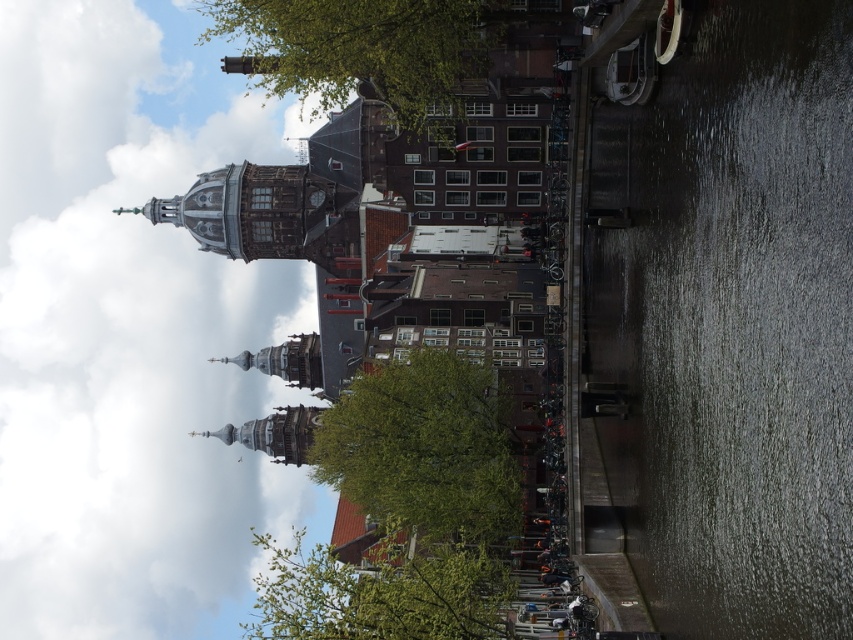
You are a tourist standing at the canal side and want to take a photo of the grand building with the dome. There are two green leafy trees in your viewfinder. Which tree, the green leafy tree at upper center or the green leafy tree at lower center, is closer to the building?

The green leafy tree at lower center is closer to the grand building with the dome because the green leafy tree at upper center is positioned over it, meaning it is farther away from the building.

In the scene shown: You are a tourist standing on the canal side and want to take a photo of the dark gray concrete waterway at right and the green leafy tree at lower center. Which object will appear closer to the camera in your photo?

The dark gray concrete waterway at right will appear closer to the camera in your photo because it is positioned in front of the green leafy tree at lower center.

From the picture: You are a tourist standing at the lower center of the image near the green leafy tree at lower center. You want to take a photo of the dark gray concrete waterway at right. Which direction should you turn to face the waterway?

The dark gray concrete waterway at right is positioned on the right side of green leafy tree at lower center, so you should turn to your right to face the waterway.